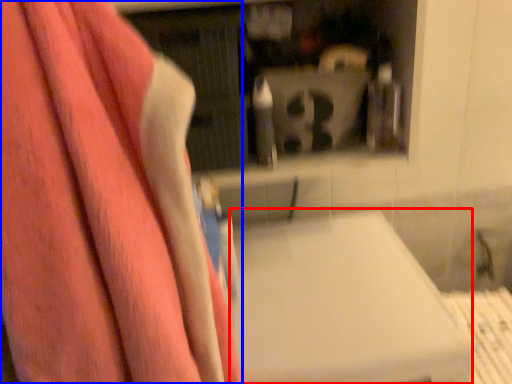
Question: Which object appears closest to the camera in this image, lift (highlighted by a red box) or towel (highlighted by a blue box)?

Choices:
 (A) lift
 (B) towel

Answer: (B)